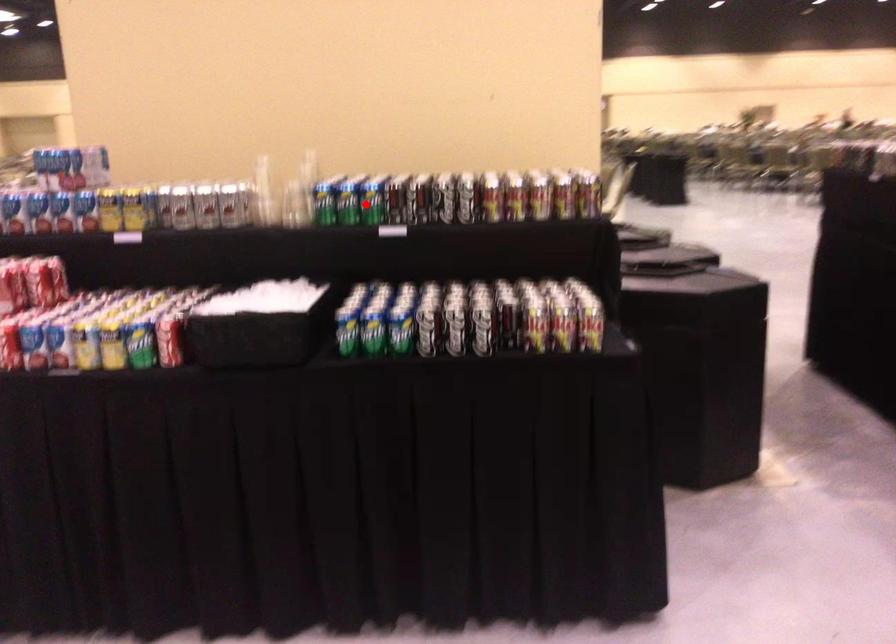
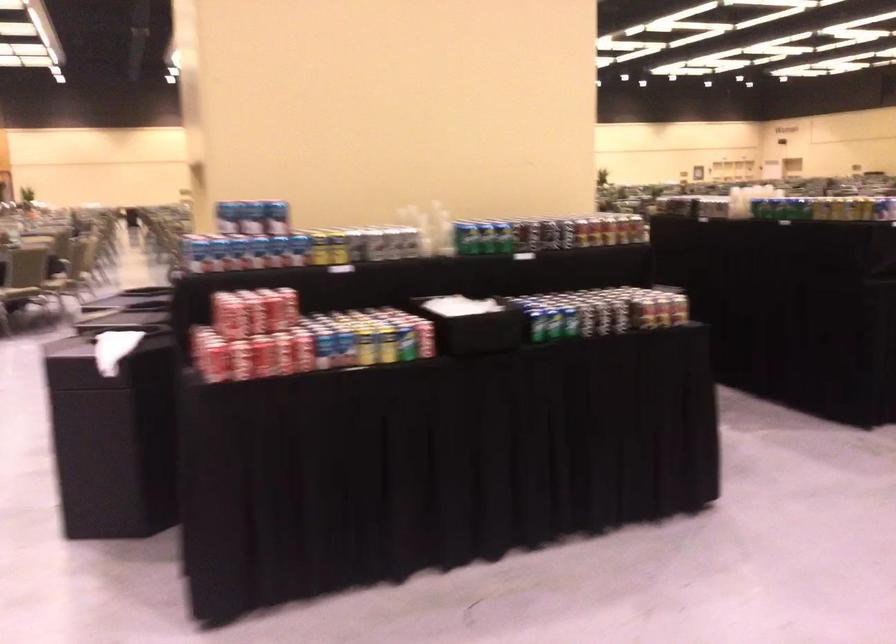
Question: I am providing you with two images of the same scene from different viewpoints. In image1, a red point is highlighted. Considering the same 3D point in image2, which of the following is correct?

Choices:
 (A) It is closer
 (B) It is farther

Answer: (B)